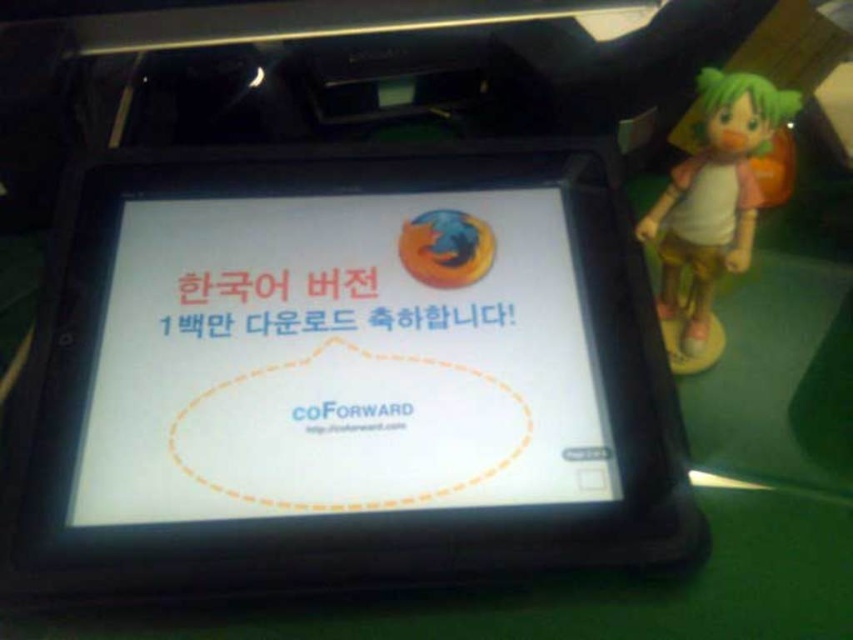
You are designing a poster and need to arrange the white glossy screen at center and the green matte figure at right. Based on their sizes, which object should you place higher on the poster to ensure proper visibility?

The green matte figure at right should be placed higher on the poster since it has a greater height than the white glossy screen at center, ensuring it is visible without being obscured.